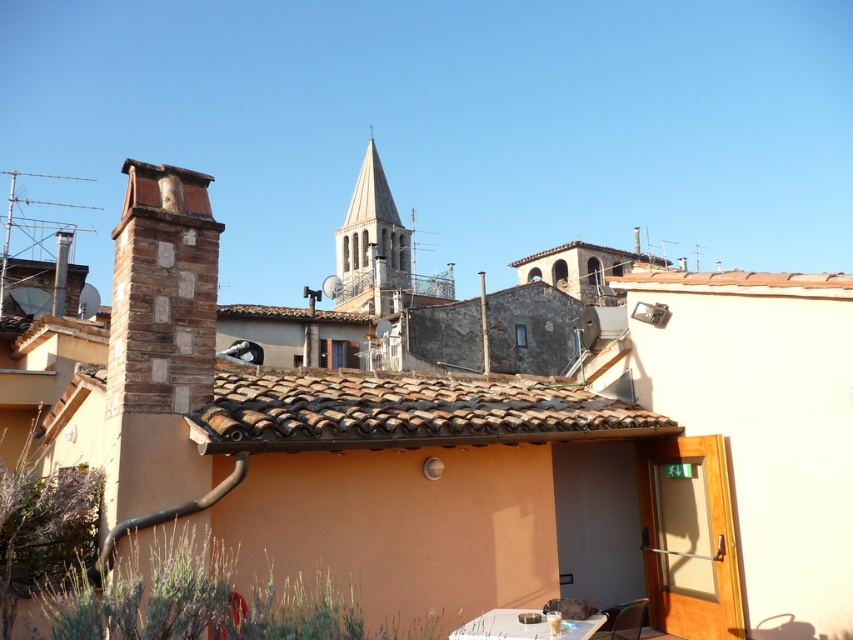
Which is behind, point (634, 268) or point (498, 620)?

Point (634, 268)

What do you see at coordinates (737, 282) in the screenshot? Image resolution: width=853 pixels, height=640 pixels. I see `brown tile roof at upper center` at bounding box center [737, 282].

Is point (686, 282) farther from viewer compared to point (520, 612)?

Yes, it is behind point (520, 612).

You are a GUI agent. You are given a task and a screenshot of the screen. Output one action in this format:
    pyautogui.click(x=<x>, y=<y>)
    Task: Click on the brown tile roof at upper center
    This screenshot has height=640, width=853.
    Given the screenshot: What is the action you would take?
    pyautogui.click(x=737, y=282)

Between brown stone chimney at left and white glossy table at lower center, which one is positioned higher?

brown stone chimney at left

Between point (184, 340) and point (488, 634), which one is positioned in front?

Point (488, 634) is more forward.

Is point (119, 273) less distant than point (579, 630)?

No, (119, 273) is behind (579, 630).

Where is `brown stone chimney at left`? This screenshot has height=640, width=853. brown stone chimney at left is located at coordinates (161, 292).

Which is more to the right, brown clay tiles at center or stone steeple at center?

From the viewer's perspective, brown clay tiles at center appears more on the right side.

Can you confirm if brown clay tiles at center is positioned to the right of stone steeple at center?

Indeed, brown clay tiles at center is positioned on the right side of stone steeple at center.

Which is in front, point (508, 403) or point (350, 305)?

Point (508, 403) is in front.

At what (x,y) coordinates should I click in order to perform the action: click on brown clay tiles at center. Please return your answer as a coordinate pair (x, y). Looking at the image, I should click on (404, 410).